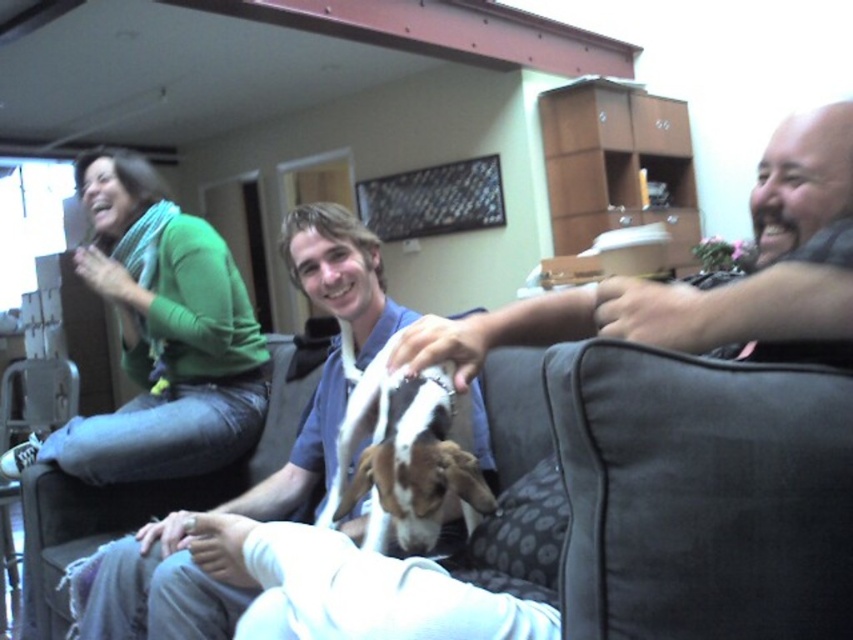
You are planning to take a photo of the green sweater at upper left and the white fur dog at center. Which object should you focus on first if you want to capture both in the same frame without moving the camera?

The green sweater at upper left is larger in size compared to the white fur dog at center, so you should focus on the green sweater at upper left first to ensure it fits properly in the frame.

You are a photographer trying to capture a candid shot of the smooth gray shirt at right and the white fur dog at center. Based on their positions, which one is positioned higher in the frame?

The smooth gray shirt at right is above the white fur dog at center, so it is positioned higher in the frame.

You are trying to decide which shirt to wear for a casual dinner. Both the smooth gray shirt at right and the white soft shirt at center are options. Which one is larger?

The white soft shirt at center is larger than the smooth gray shirt at right.